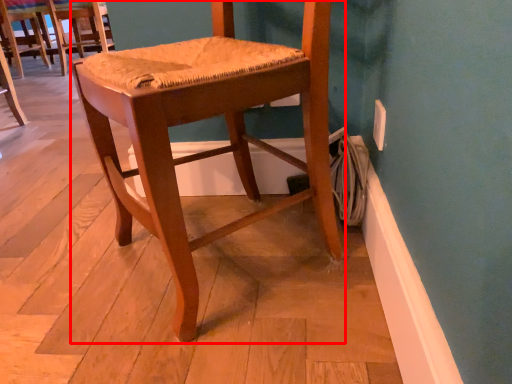
Question: From the image's perspective, where is chair (annotated by the red box) located relative to chair?

Choices:
 (A) above
 (B) below

Answer: (B)